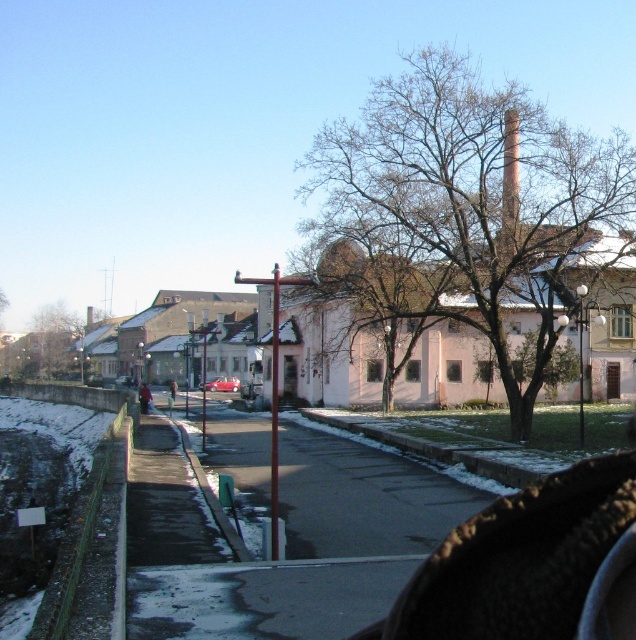
What do you see at coordinates (478, 200) in the screenshot? I see `bare branches at center` at bounding box center [478, 200].

Where is `bare branches at center`? bare branches at center is located at coordinates (478, 200).

Is point (424, 173) behind point (516, 193)?

No.

You are a GUI agent. You are given a task and a screenshot of the screen. Output one action in this format:
    pyautogui.click(x=<x>, y=<y>)
    Task: Click on the bare branches at center
    
    Given the screenshot: What is the action you would take?
    pyautogui.click(x=478, y=200)

Does brown leafless tree at left have a larger size compared to smooth gray chimney at upper right?

Yes.

Is brown leafless tree at left further to camera compared to smooth gray chimney at upper right?

Yes, it is.

The image size is (636, 640). I want to click on brown leafless tree at left, so click(x=52, y=344).

Who is positioned more to the left, smooth gray chimney at upper right or shiny red car at center?

shiny red car at center

Does smooth gray chimney at upper right have a greater height compared to shiny red car at center?

No, smooth gray chimney at upper right is not taller than shiny red car at center.

What do you see at coordinates (509, 172) in the screenshot? I see `smooth gray chimney at upper right` at bounding box center [509, 172].

Locate an element on the screen. The height and width of the screenshot is (640, 636). smooth gray chimney at upper right is located at coordinates (509, 172).